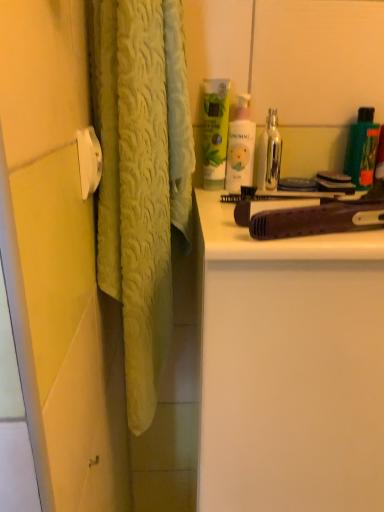
Question: Considering the relative sizes of green plastic bottle at upper right, the second toiletry viewed from the left, and green matte bottle at upper right, which ranks as the 2th mouthwash in left-to-right order, in the image provided, is green plastic bottle at upper right, the second toiletry viewed from the left, bigger than green matte bottle at upper right, which ranks as the 2th mouthwash in left-to-right order,?

Choices:
 (A) no
 (B) yes

Answer: (B)

Question: From a real-world perspective, is green plastic bottle at upper right, the second toiletry viewed from the left, over green matte bottle at upper right, the first mouthwash when ordered from right to left?

Choices:
 (A) no
 (B) yes

Answer: (A)

Question: Is the depth of green plastic bottle at upper right, the second toiletry viewed from the left, greater than that of green matte bottle at upper right, which ranks as the 2th mouthwash in left-to-right order?

Choices:
 (A) no
 (B) yes

Answer: (B)

Question: Does green plastic bottle at upper right, arranged as the 1th toiletry when viewed from the right, turn towards green matte bottle at upper right, the first mouthwash when ordered from right to left?

Choices:
 (A) no
 (B) yes

Answer: (A)

Question: Does green plastic bottle at upper right, the second toiletry viewed from the left, have a greater width compared to green matte bottle at upper right, the first mouthwash when ordered from right to left?

Choices:
 (A) no
 (B) yes

Answer: (B)

Question: Can you confirm if green plastic bottle at upper right, arranged as the 1th toiletry when viewed from the right, is smaller than green matte bottle at upper right, the first mouthwash when ordered from right to left?

Choices:
 (A) no
 (B) yes

Answer: (A)

Question: Is green matte bottle at upper right, which ranks as the 2th mouthwash in left-to-right order, positioned behind metallic silver mouthwash at upper right, marked as the 2th mouthwash in a right-to-left arrangement?

Choices:
 (A) no
 (B) yes

Answer: (B)

Question: Is green matte bottle at upper right, the first mouthwash when ordered from right to left, next to metallic silver mouthwash at upper right, arranged as the 1th mouthwash when viewed from the left, and touching it?

Choices:
 (A) yes
 (B) no

Answer: (B)

Question: Can you confirm if green matte bottle at upper right, which ranks as the 2th mouthwash in left-to-right order, is taller than metallic silver mouthwash at upper right, arranged as the 1th mouthwash when viewed from the left?

Choices:
 (A) yes
 (B) no

Answer: (A)

Question: Does green matte bottle at upper right, the first mouthwash when ordered from right to left, appear on the left side of metallic silver mouthwash at upper right, marked as the 2th mouthwash in a right-to-left arrangement?

Choices:
 (A) yes
 (B) no

Answer: (B)

Question: From a real-world perspective, is green matte bottle at upper right, which ranks as the 2th mouthwash in left-to-right order, on top of metallic silver mouthwash at upper right, arranged as the 1th mouthwash when viewed from the left?

Choices:
 (A) yes
 (B) no

Answer: (A)

Question: Is green matte bottle at upper right, which ranks as the 2th mouthwash in left-to-right order, shorter than metallic silver mouthwash at upper right, arranged as the 1th mouthwash when viewed from the left?

Choices:
 (A) no
 (B) yes

Answer: (A)

Question: Does white matte cabinet at right have a larger size compared to green matte lotion at upper center?

Choices:
 (A) no
 (B) yes

Answer: (B)